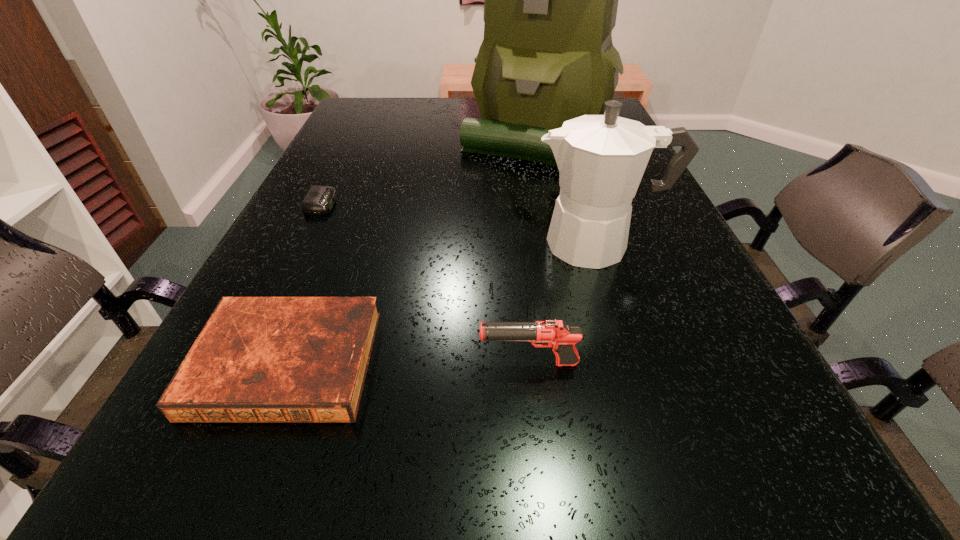
Where is `free area in between the third shortest object and the backpack`? free area in between the third shortest object and the backpack is located at coordinates (532, 251).

The height and width of the screenshot is (540, 960). Find the location of `free space between the Bible and the third tallest object`. free space between the Bible and the third tallest object is located at coordinates (408, 363).

Locate an element on the screen. This screenshot has width=960, height=540. vacant space in between the second shortest object and the second farthest object is located at coordinates (304, 284).

Locate an element on the screen. vacant space that's between the Bible and the second tallest object is located at coordinates (443, 303).

Where is `vacant point located between the backpack and the fourth nearest object`? This screenshot has width=960, height=540. vacant point located between the backpack and the fourth nearest object is located at coordinates (428, 171).

The height and width of the screenshot is (540, 960). In order to click on empty location between the farthest object and the fourth tallest object in this screenshot , I will do click(x=410, y=251).

Locate an element on the screen. This screenshot has height=540, width=960. blank region between the alarm clock and the third shortest object is located at coordinates (425, 284).

In order to click on vacant region between the third nearest object and the Bible in this screenshot , I will do `click(443, 303)`.

You are a GUI agent. You are given a task and a screenshot of the screen. Output one action in this format:
    pyautogui.click(x=<x>, y=<y>)
    Task: Click on the object that stands as the third closest to the shortest object
    The image size is (960, 540).
    Given the screenshot: What is the action you would take?
    pyautogui.click(x=601, y=159)

Where is `the third closest object to the Bible`? The width and height of the screenshot is (960, 540). the third closest object to the Bible is located at coordinates (601, 159).